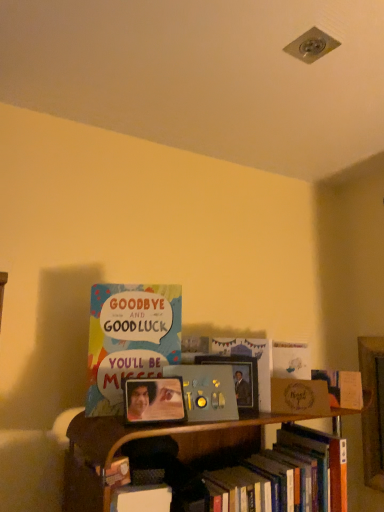
Question: Do you think metallic silver remote control at center, which is the 3th book in top-to-bottom order, is within wooden plaque at center, marked as the fourth book in a top-to-bottom arrangement, or outside of it?

Choices:
 (A) outside
 (B) inside

Answer: (A)

Question: Considering the positions of metallic silver remote control at center, which is the 3th book in top-to-bottom order, and wooden plaque at center, which is counted as the second book, starting from the bottom, in the image, is metallic silver remote control at center, which is the 3th book in top-to-bottom order, wider or thinner than wooden plaque at center, which is counted as the second book, starting from the bottom,?

Choices:
 (A) wide
 (B) thin

Answer: (B)

Question: Considering the real-world distances, which object is farthest from the metallic silver remote control at center, which is the 3th book in bottom-to-top order?

Choices:
 (A) hardcover book at lower right, the 1th book from the bottom
 (B) multicolored paper card at center, positioned as the first book in top-to-bottom order
 (C) white matte card at upper center, placed as the 4th book when sorted from bottom to top
 (D) wooden plaque at center, marked as the fourth book in a top-to-bottom arrangement
 (E) matte gold card at right

Answer: (D)

Question: Which of these objects is positioned closest to the white matte card at upper center, placed as the 4th book when sorted from bottom to top?

Choices:
 (A) hardcover book at lower right, the fifth book positioned from the top
 (B) metallic silver remote control at center, which is the 3th book in bottom-to-top order
 (C) matte gold card at right
 (D) multicolored paper card at center, positioned as the first book in top-to-bottom order
 (E) wooden plaque at center, marked as the fourth book in a top-to-bottom arrangement

Answer: (E)